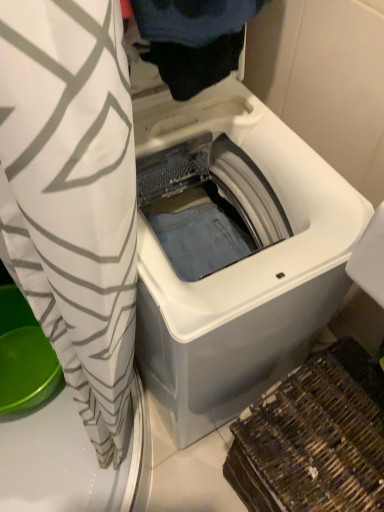
Locate an element on the screen. white plastic washing machine at center is located at coordinates (231, 251).

The height and width of the screenshot is (512, 384). What do you see at coordinates (231, 251) in the screenshot? I see `white plastic washing machine at center` at bounding box center [231, 251].

The image size is (384, 512). Find the location of `white plastic washing machine at center`. white plastic washing machine at center is located at coordinates (231, 251).